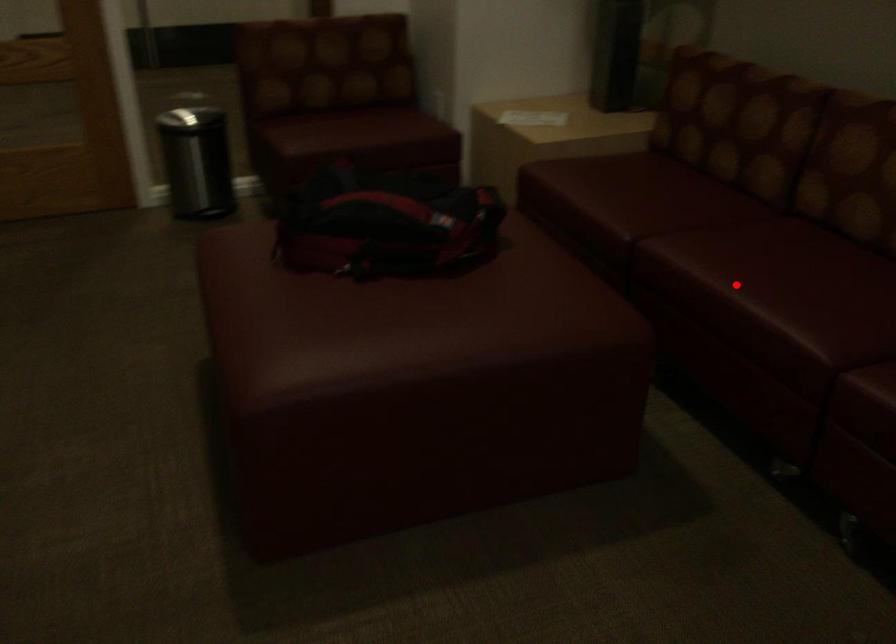
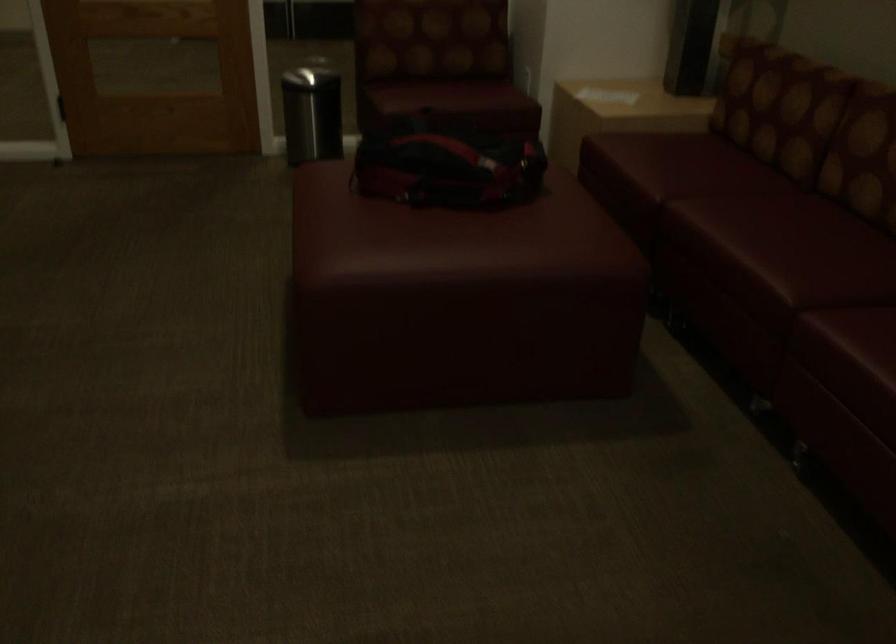
The point at the highlighted location is marked in the first image. Where is the corresponding point in the second image?

(736, 240)